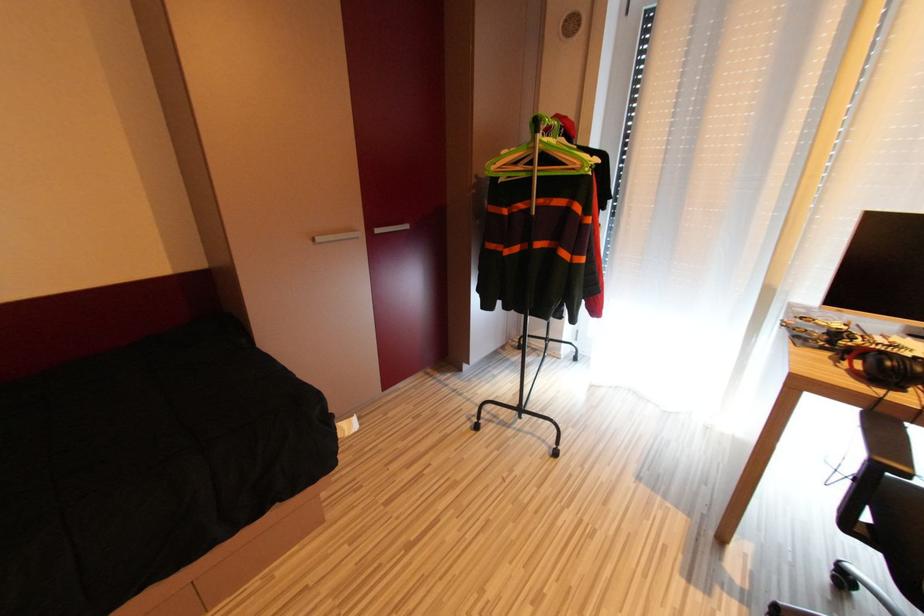
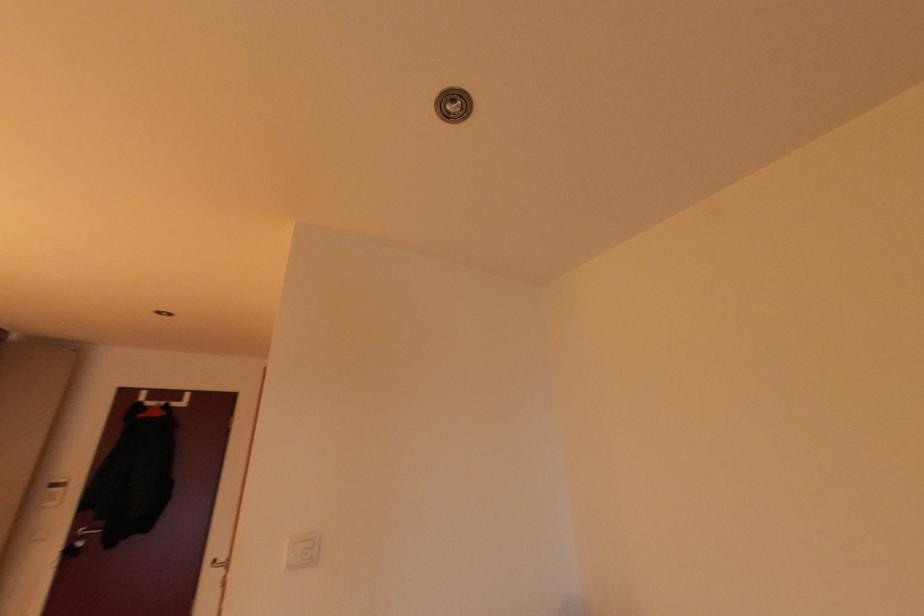
Question: The images are taken continuously from a first-person perspective. In which direction is your viewpoint rotating?

Choices:
 (A) Left
 (B) Right
 (C) Up
 (D) Down

Answer: (A)